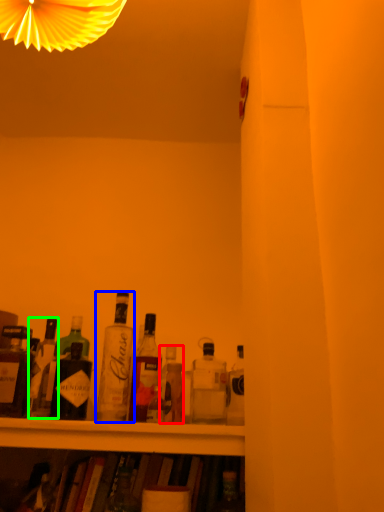
Question: Which object is positioned closest to bottle (highlighted by a red box)? Select from bottle (highlighted by a blue box) and bottle (highlighted by a green box).

Choices:
 (A) bottle
 (B) bottle

Answer: (A)